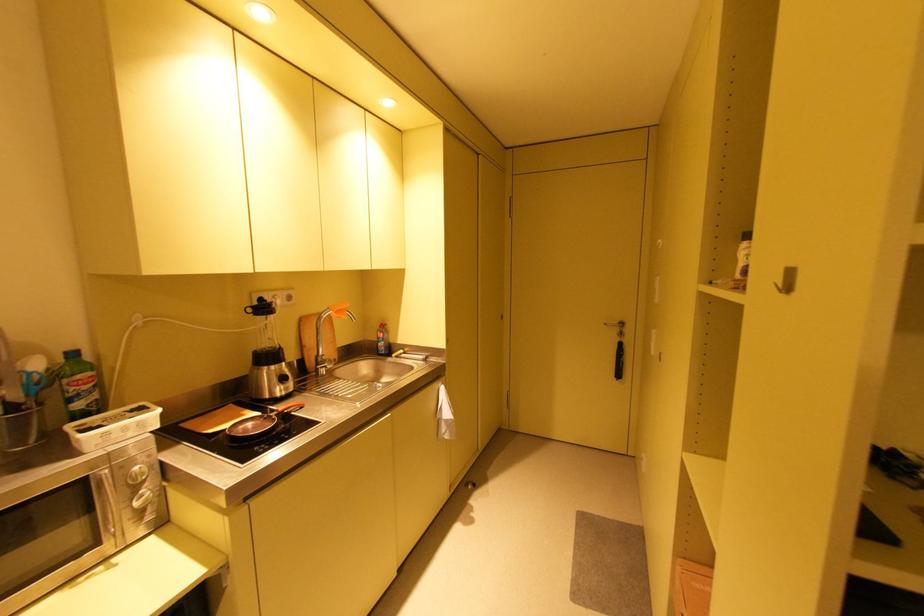
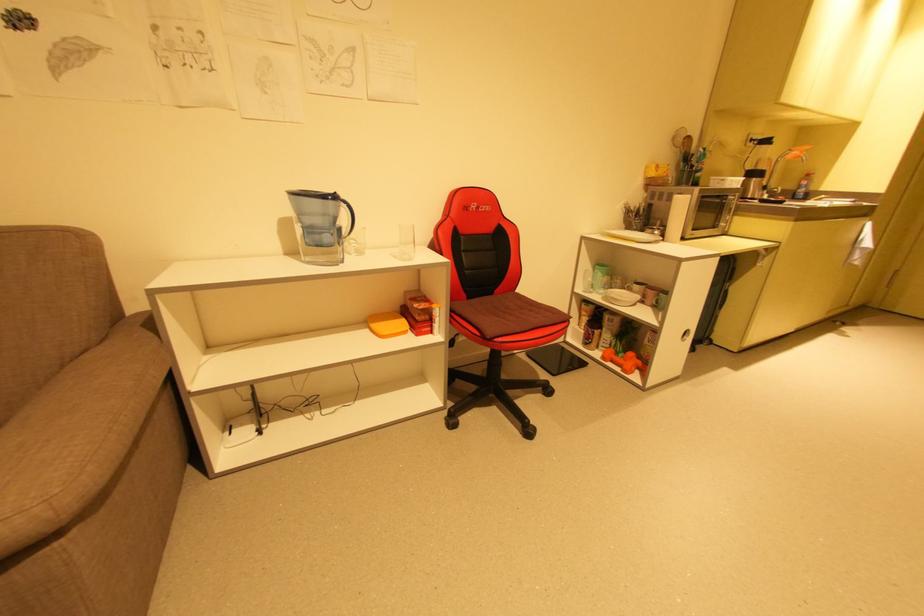
Where in the second image is the point corresponding to [342,312] from the first image?

(805, 152)